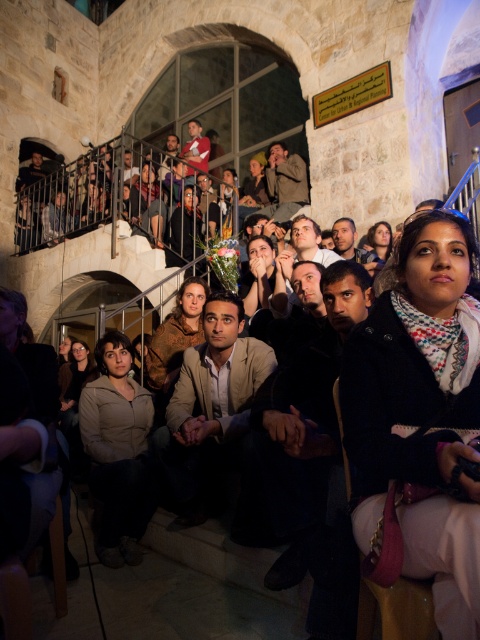
Between dark blue shirt at upper center and matte black jacket at center, which one has less height?

matte black jacket at center is shorter.

Who is positioned more to the right, dark blue shirt at upper center or matte black jacket at center?

matte black jacket at center is more to the right.

Between point (168, 260) and point (373, 262), which one is positioned behind?

The point (168, 260) is behind.

The width and height of the screenshot is (480, 640). In order to click on dark blue shirt at upper center in this screenshot , I will do (x=184, y=228).

Who is positioned more to the right, smooth brown hair at center or matte brown hair at upper center?

smooth brown hair at center is more to the right.

Is point (352, 243) closer to camera compared to point (149, 166)?

Yes, point (352, 243) is in front of point (149, 166).

The image size is (480, 640). Identify the location of smooth brown hair at center. (352, 244).

At what (x,y) coordinates should I click in order to perform the action: click on smooth brown hair at center. Please return your answer as a coordinate pair (x, y). This screenshot has height=640, width=480. Looking at the image, I should click on (352, 244).

Consider the image. Is matte beige jacket at center wider than brown leather jacket at upper center?

No, matte beige jacket at center is not wider than brown leather jacket at upper center.

Between matte beige jacket at center and brown leather jacket at upper center, which one is positioned higher?

Positioned higher is brown leather jacket at upper center.

Does point (117, 532) lie in front of point (282, 186)?

Yes, it is.

The width and height of the screenshot is (480, 640). I want to click on matte beige jacket at center, so click(118, 451).